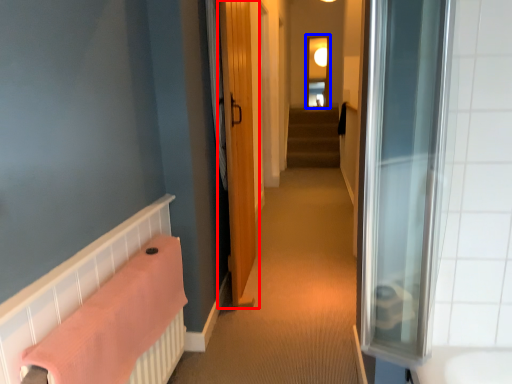
Question: Which object appears farthest to the camera in this image, door (highlighted by a red box) or window (highlighted by a blue box)?

Choices:
 (A) door
 (B) window

Answer: (B)